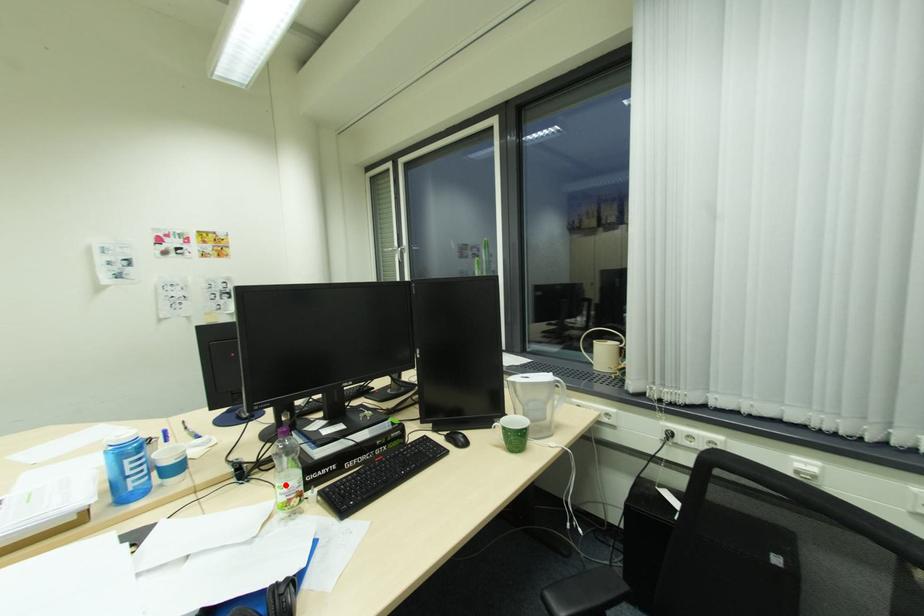
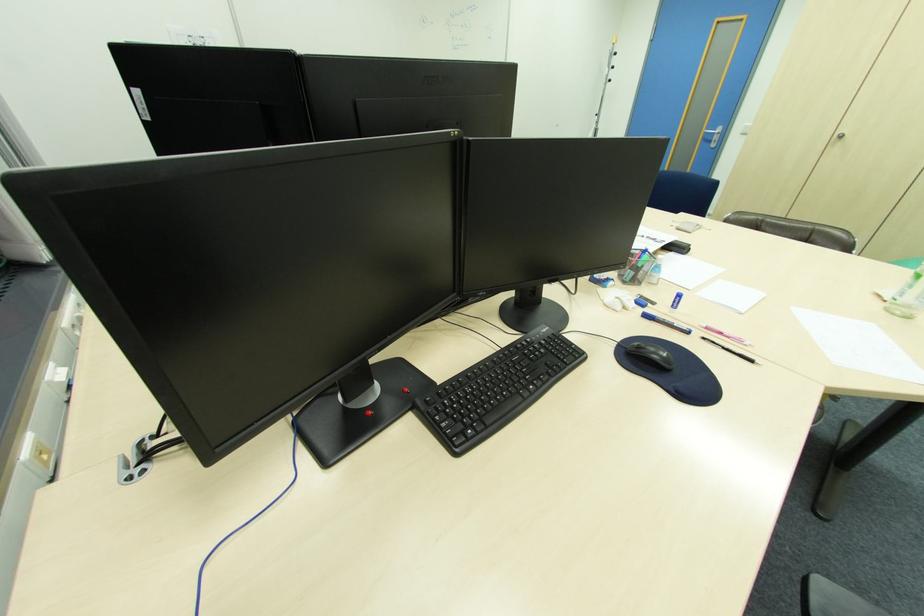
Question: I am providing you with two images of the same scene from different viewpoints. A red point is marked on the first image. Is the red point's position out of view in image 2?

Choices:
 (A) Yes
 (B) No

Answer: (A)